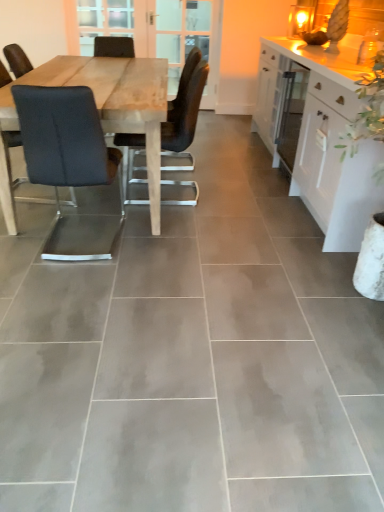
You are a GUI agent. You are given a task and a screenshot of the screen. Output one action in this format:
    pyautogui.click(x=<x>, y=<y>)
    Task: Click on the clear glass screen door at upper center, placed as the 2th screen door when sorted from left to right
    The height and width of the screenshot is (512, 384).
    Given the screenshot: What is the action you would take?
    pyautogui.click(x=188, y=39)

Find the location of `white glossy cabinet at right`. white glossy cabinet at right is located at coordinates (328, 143).

What do you see at coordinates (185, 114) in the screenshot? I see `matte black chair at center, which appears as the second chair when viewed from the left` at bounding box center [185, 114].

Where is `clear glass screen door at upper center, which is counted as the first screen door, starting from the right`? This screenshot has width=384, height=512. clear glass screen door at upper center, which is counted as the first screen door, starting from the right is located at coordinates (188, 39).

Which is more distant, (114, 169) or (216, 0)?

The point (216, 0) is more distant.

Could you tell me if black fabric chair at left, positioned as the second chair in right-to-left order, is turned towards clear glass screen door at upper center, placed as the 2th screen door when sorted from left to right?

Yes, black fabric chair at left, positioned as the second chair in right-to-left order, is oriented towards clear glass screen door at upper center, placed as the 2th screen door when sorted from left to right.

Which object is further away from the camera taking this photo, black fabric chair at left, positioned as the second chair in right-to-left order, or clear glass screen door at upper center, which is counted as the first screen door, starting from the right?

clear glass screen door at upper center, which is counted as the first screen door, starting from the right, is further from the camera.

Which of these two, wooden screen door at center, the first screen door when ordered from left to right, or black fabric chair at left, positioned as the second chair in right-to-left order, stands shorter?

black fabric chair at left, positioned as the second chair in right-to-left order, is shorter.

From a real-world perspective, between wooden screen door at center, which is counted as the 2th screen door, starting from the right, and black fabric chair at left, positioned as the second chair in right-to-left order, who is vertically higher?

wooden screen door at center, which is counted as the 2th screen door, starting from the right, is physically above.

Considering the relative positions of wooden screen door at center, which is counted as the 2th screen door, starting from the right, and black fabric chair at left, which is the first chair from left to right, in the image provided, is wooden screen door at center, which is counted as the 2th screen door, starting from the right, in front of black fabric chair at left, which is the first chair from left to right,?

No, wooden screen door at center, which is counted as the 2th screen door, starting from the right, is further to the viewer.

Is white glossy cabinet at right taller than wooden screen door at center, the first screen door when ordered from left to right?

No.

Is white glossy cabinet at right not near wooden screen door at center, which is counted as the 2th screen door, starting from the right?

Yes, white glossy cabinet at right and wooden screen door at center, which is counted as the 2th screen door, starting from the right, are quite far apart.

Is the depth of white glossy cabinet at right greater than that of wooden screen door at center, the first screen door when ordered from left to right?

No.

What's the angular difference between white glossy cabinet at right and wooden screen door at center, which is counted as the 2th screen door, starting from the right,'s facing directions?

89.6 degrees separate the facing orientations of white glossy cabinet at right and wooden screen door at center, which is counted as the 2th screen door, starting from the right.

Considering the relative sizes of white glossy cabinet at right and clear glass screen door at upper center, which is counted as the first screen door, starting from the right, in the image provided, is white glossy cabinet at right taller than clear glass screen door at upper center, which is counted as the first screen door, starting from the right,?

Incorrect, the height of white glossy cabinet at right is not larger of that of clear glass screen door at upper center, which is counted as the first screen door, starting from the right.

From a real-world perspective, does white glossy cabinet at right stand above clear glass screen door at upper center, placed as the 2th screen door when sorted from left to right?

Incorrect, from a real-world perspective, white glossy cabinet at right is lower than clear glass screen door at upper center, placed as the 2th screen door when sorted from left to right.

Which point is more distant from viewer, [328,69] or [179,50]?

The point [179,50] is more distant.

Is black fabric chair at left, positioned as the second chair in right-to-left order, further to the viewer compared to matte black chair at center, which is the first chair in right-to-left order?

No, black fabric chair at left, positioned as the second chair in right-to-left order, is closer to the camera.

Which is more to the right, black fabric chair at left, positioned as the second chair in right-to-left order, or matte black chair at center, which is the first chair in right-to-left order?

Positioned to the right is matte black chair at center, which is the first chair in right-to-left order.

Between black fabric chair at left, which is the first chair from left to right, and matte black chair at center, which appears as the second chair when viewed from the left, which one has more height?

Standing taller between the two is matte black chair at center, which appears as the second chair when viewed from the left.

How far apart are black fabric chair at left, positioned as the second chair in right-to-left order, and matte black chair at center, which appears as the second chair when viewed from the left?

They are 25.23 inches apart.

Where is `screen door that is the 2nd object above the matte black chair at center, which is the first chair in right-to-left order (from a real-world perspective)`? The image size is (384, 512). screen door that is the 2nd object above the matte black chair at center, which is the first chair in right-to-left order (from a real-world perspective) is located at coordinates (188, 39).

Is matte black chair at center, which is the first chair in right-to-left order, turned away from clear glass screen door at upper center, placed as the 2th screen door when sorted from left to right?

No, clear glass screen door at upper center, placed as the 2th screen door when sorted from left to right, is not at the back of matte black chair at center, which is the first chair in right-to-left order.

Does point (128, 144) come behind point (194, 22)?

No, it is in front of (194, 22).

Is matte black chair at center, which appears as the second chair when viewed from the left, situated inside clear glass screen door at upper center, which is counted as the first screen door, starting from the right, or outside?

matte black chair at center, which appears as the second chair when viewed from the left, is located beyond the bounds of clear glass screen door at upper center, which is counted as the first screen door, starting from the right.

From a real-world perspective, is clear glass screen door at upper center, which is counted as the first screen door, starting from the right, positioned above or below matte black chair at center, which appears as the second chair when viewed from the left?

From a real-world perspective, clear glass screen door at upper center, which is counted as the first screen door, starting from the right, is physically above matte black chair at center, which appears as the second chair when viewed from the left.

Between clear glass screen door at upper center, placed as the 2th screen door when sorted from left to right, and matte black chair at center, which appears as the second chair when viewed from the left, which one has smaller size?

clear glass screen door at upper center, placed as the 2th screen door when sorted from left to right.

Is clear glass screen door at upper center, which is counted as the first screen door, starting from the right, next to matte black chair at center, which is the first chair in right-to-left order?

No, clear glass screen door at upper center, which is counted as the first screen door, starting from the right, is not beside matte black chair at center, which is the first chair in right-to-left order.

Is clear glass screen door at upper center, placed as the 2th screen door when sorted from left to right, positioned before matte black chair at center, which is the first chair in right-to-left order?

That is False.

The image size is (384, 512). Find the location of `the 2nd screen door behind when counting from the black fabric chair at left, positioned as the second chair in right-to-left order`. the 2nd screen door behind when counting from the black fabric chair at left, positioned as the second chair in right-to-left order is located at coordinates [x=188, y=39].

From the image's perspective, count 2nd screen doors upward from the black fabric chair at left, positioned as the second chair in right-to-left order, and point to it. Please provide its 2D coordinates.

[(159, 33)]

Looking at the image, which one is located closer to black fabric chair at left, positioned as the second chair in right-to-left order, clear glass screen door at upper center, placed as the 2th screen door when sorted from left to right, or white glossy cabinet at right?

Among the two, white glossy cabinet at right is located nearer to black fabric chair at left, positioned as the second chair in right-to-left order.

Considering their positions, is wooden screen door at center, the first screen door when ordered from left to right, positioned further to black fabric chair at left, positioned as the second chair in right-to-left order, than matte black chair at center, which is the first chair in right-to-left order?

wooden screen door at center, the first screen door when ordered from left to right, is further to black fabric chair at left, positioned as the second chair in right-to-left order.

Which object lies further to the anchor point wooden screen door at center, the first screen door when ordered from left to right, black fabric chair at left, which is the first chair from left to right, or matte black chair at center, which appears as the second chair when viewed from the left?

black fabric chair at left, which is the first chair from left to right.

From the image, which object appears to be farther from wooden screen door at center, the first screen door when ordered from left to right, black fabric chair at left, which is the first chair from left to right, or white glossy cabinet at right?

Among the two, black fabric chair at left, which is the first chair from left to right, is located further to wooden screen door at center, the first screen door when ordered from left to right.

Considering their positions, is matte black chair at center, which appears as the second chair when viewed from the left, positioned closer to white glossy cabinet at right than clear glass screen door at upper center, which is counted as the first screen door, starting from the right?

matte black chair at center, which appears as the second chair when viewed from the left, lies closer to white glossy cabinet at right than the other object.

Considering their positions, is matte black chair at center, which is the first chair in right-to-left order, positioned further to clear glass screen door at upper center, placed as the 2th screen door when sorted from left to right, than black fabric chair at left, which is the first chair from left to right?

black fabric chair at left, which is the first chair from left to right, is further to clear glass screen door at upper center, placed as the 2th screen door when sorted from left to right.

Looking at the image, which one is located closer to white glossy cabinet at right, clear glass screen door at upper center, which is counted as the first screen door, starting from the right, or black fabric chair at left, positioned as the second chair in right-to-left order?

black fabric chair at left, positioned as the second chair in right-to-left order, is positioned closer to the anchor white glossy cabinet at right.

Estimate the real-world distances between objects in this image. Which object is further from matte black chair at center, which appears as the second chair when viewed from the left, clear glass screen door at upper center, placed as the 2th screen door when sorted from left to right, or wooden screen door at center, the first screen door when ordered from left to right?

Based on the image, clear glass screen door at upper center, placed as the 2th screen door when sorted from left to right, appears to be further to matte black chair at center, which appears as the second chair when viewed from the left.

This screenshot has width=384, height=512. Find the location of `screen door between matte black chair at center, which appears as the second chair when viewed from the left, and clear glass screen door at upper center, which is counted as the first screen door, starting from the right, along the z-axis`. screen door between matte black chair at center, which appears as the second chair when viewed from the left, and clear glass screen door at upper center, which is counted as the first screen door, starting from the right, along the z-axis is located at coordinates (159, 33).

Locate an element on the screen. chair positioned between black fabric chair at left, positioned as the second chair in right-to-left order, and clear glass screen door at upper center, which is counted as the first screen door, starting from the right, from near to far is located at coordinates (185, 114).

Where is `cabinetry located between black fabric chair at left, positioned as the second chair in right-to-left order, and clear glass screen door at upper center, which is counted as the first screen door, starting from the right, in the depth direction`? The width and height of the screenshot is (384, 512). cabinetry located between black fabric chair at left, positioned as the second chair in right-to-left order, and clear glass screen door at upper center, which is counted as the first screen door, starting from the right, in the depth direction is located at coordinates (328, 143).

At what (x,y) coordinates should I click in order to perform the action: click on chair positioned between black fabric chair at left, positioned as the second chair in right-to-left order, and wooden screen door at center, which is counted as the 2th screen door, starting from the right, from near to far. Please return your answer as a coordinate pair (x, y). Looking at the image, I should click on (185, 114).